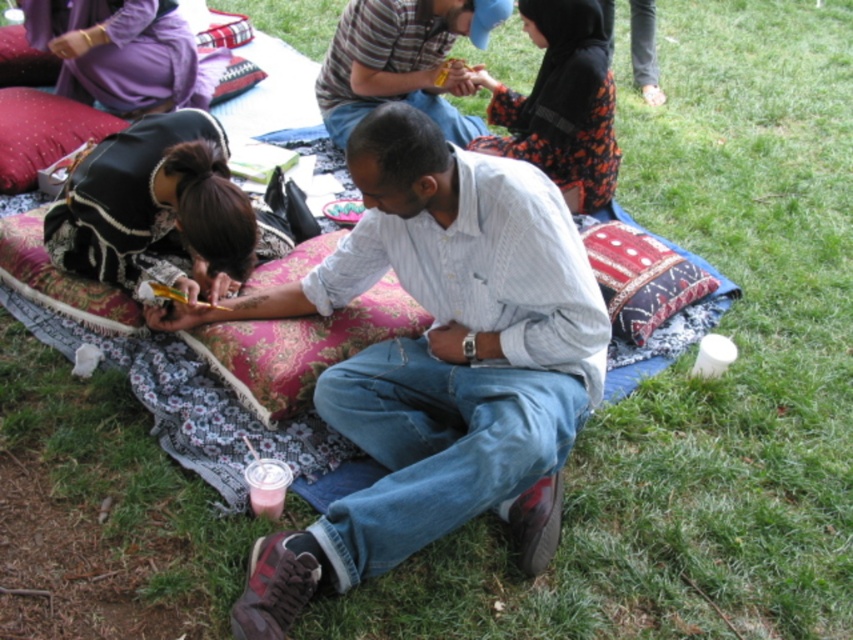
Is black lace dress at center shorter than matte purple dress at upper left?

No, black lace dress at center is not shorter than matte purple dress at upper left.

Between black lace dress at center and matte purple dress at upper left, which one has more height?

Standing taller between the two is black lace dress at center.

Locate an element on the screen. The height and width of the screenshot is (640, 853). black lace dress at center is located at coordinates (155, 209).

How much distance is there between striped cotton shirt at upper center and textured red pillow at center?

striped cotton shirt at upper center is 3.45 feet away from textured red pillow at center.

Is striped cotton shirt at upper center bigger than textured red pillow at center?

Yes, striped cotton shirt at upper center is bigger than textured red pillow at center.

Find the location of `striped cotton shirt at upper center`. striped cotton shirt at upper center is located at coordinates coord(403,60).

Where is `striped cotton shirt at upper center`? The image size is (853, 640). striped cotton shirt at upper center is located at coordinates (403, 60).

Who is higher up, black floral dress at center or velvet cushion at upper left?

velvet cushion at upper left is higher up.

Is black floral dress at center thinner than velvet cushion at upper left?

No.

Is point (605, 118) positioned behind point (13, 61)?

No.

Locate an element on the screen. black floral dress at center is located at coordinates [561, 104].